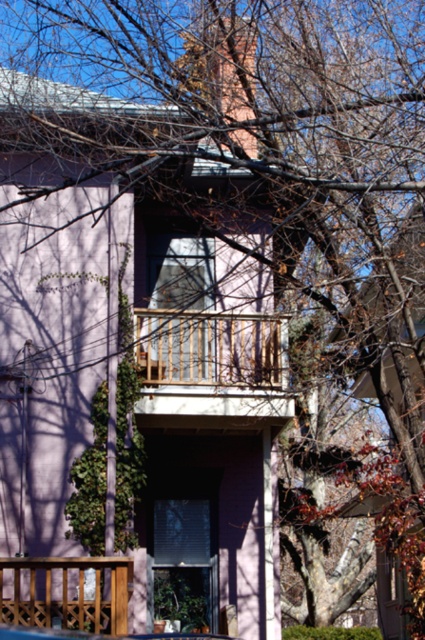
You are standing at the base of the residential building and see two points marked on the wall. The first point is at coordinates point (147, 332) and the second is at point (67, 620). Which point is closer to the balcony on the second floor?

Point (147, 332) is behind point (67, 620), so the point closer to the balcony on the second floor would be point (147, 332) since it is further back on the wall.

You are standing in front of the two story residential building with light pink exterior wall. You see a wooden at center located at point (207, 348). What is the location of the wooden at center in the image?

The wooden at center is located at point (207, 348).

You are a painter who needs to place a ladder to paint the wooden at center and wooden at lower left. The ladder you have is 3 meters long. Can you reach both areas with this ladder without moving it?

The wooden at center and wooden at lower left are 3.16 meters apart. Since the ladder is only 3 meters long, it is not long enough to span the distance between them. You will need to move the ladder to reach both areas.